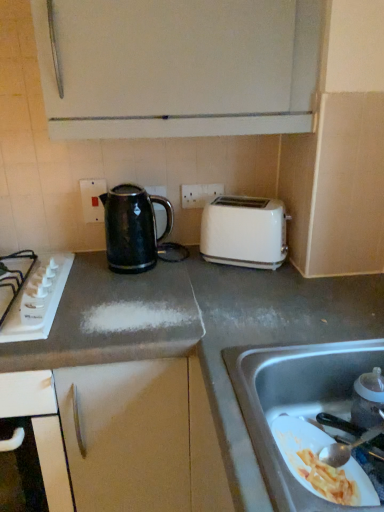
Question: Are stainless steel sink at lower right and black glossy kettle at center located far from each other?

Choices:
 (A) yes
 (B) no

Answer: (B)

Question: Is stainless steel sink at lower right positioned before black glossy kettle at center?

Choices:
 (A) yes
 (B) no

Answer: (A)

Question: Would you say black glossy kettle at center is part of stainless steel sink at lower right's contents?

Choices:
 (A) no
 (B) yes

Answer: (A)

Question: From a real-world perspective, is stainless steel sink at lower right on top of black glossy kettle at center?

Choices:
 (A) no
 (B) yes

Answer: (A)

Question: Can you confirm if stainless steel sink at lower right is wider than black glossy kettle at center?

Choices:
 (A) yes
 (B) no

Answer: (A)

Question: From the image's perspective, is stainless steel sink at lower right located beneath black glossy kettle at center?

Choices:
 (A) yes
 (B) no

Answer: (A)

Question: Would you say white glossy toaster at upper right is outside black glossy kettle at center?

Choices:
 (A) yes
 (B) no

Answer: (A)

Question: From a real-world perspective, is white glossy toaster at upper right located beneath black glossy kettle at center?

Choices:
 (A) no
 (B) yes

Answer: (B)

Question: Is white glossy toaster at upper right smaller than black glossy kettle at center?

Choices:
 (A) no
 (B) yes

Answer: (B)

Question: Is white glossy toaster at upper right in front of black glossy kettle at center?

Choices:
 (A) no
 (B) yes

Answer: (A)

Question: Can black glossy kettle at center be found inside white glossy toaster at upper right?

Choices:
 (A) no
 (B) yes

Answer: (A)

Question: Is white glossy toaster at upper right not close to black glossy kettle at center?

Choices:
 (A) no
 (B) yes

Answer: (A)

Question: Is transparent plastic baby bottle at lower right taller than stainless steel sink at lower right?

Choices:
 (A) no
 (B) yes

Answer: (A)